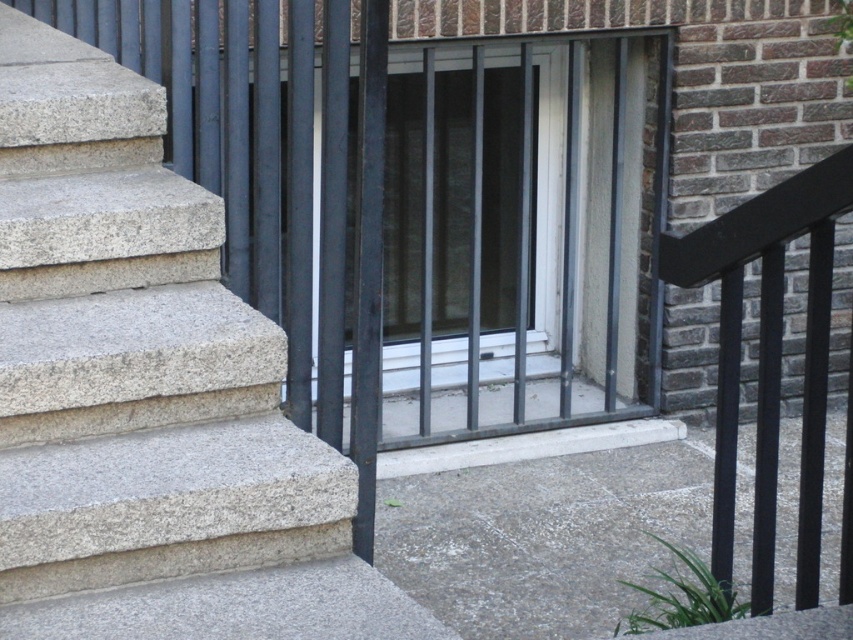
Question: Can you confirm if clear glass door at center is positioned below black metal/rail at right?

Choices:
 (A) no
 (B) yes

Answer: (A)

Question: Which object is positioned closest to the clear glass door at center?

Choices:
 (A) black metal/rail at right
 (B) smooth concrete steps at left

Answer: (B)

Question: Is clear glass door at center further to the viewer compared to black metal/rail at right?

Choices:
 (A) no
 (B) yes

Answer: (B)

Question: Can you confirm if smooth concrete steps at left is positioned above black metal/rail at right?

Choices:
 (A) yes
 (B) no

Answer: (A)

Question: Which point is closer to the camera taking this photo?

Choices:
 (A) (165, 388)
 (B) (796, 557)
 (C) (390, 282)

Answer: (A)

Question: Which is farther from the black metal/rail at right?

Choices:
 (A) clear glass door at center
 (B) smooth concrete steps at left

Answer: (A)